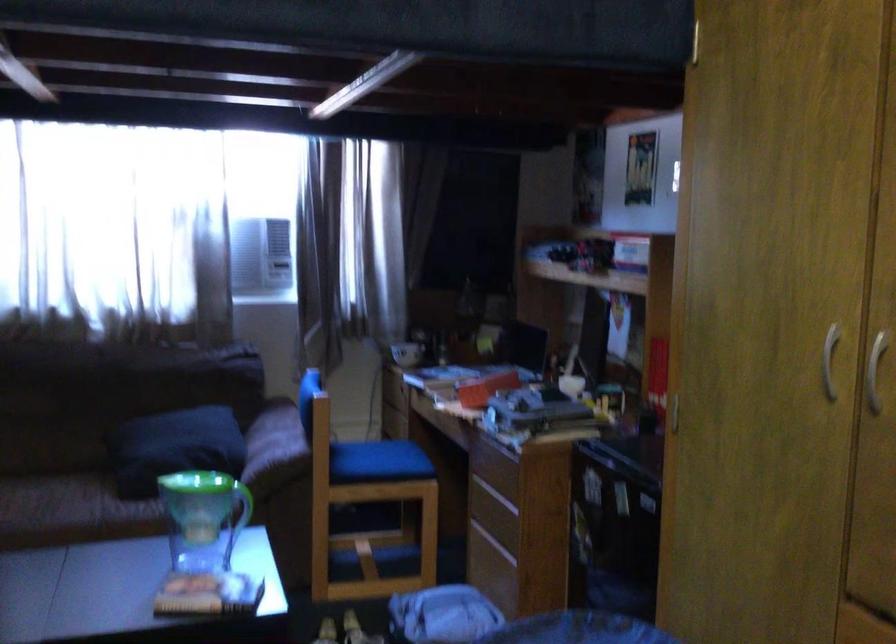
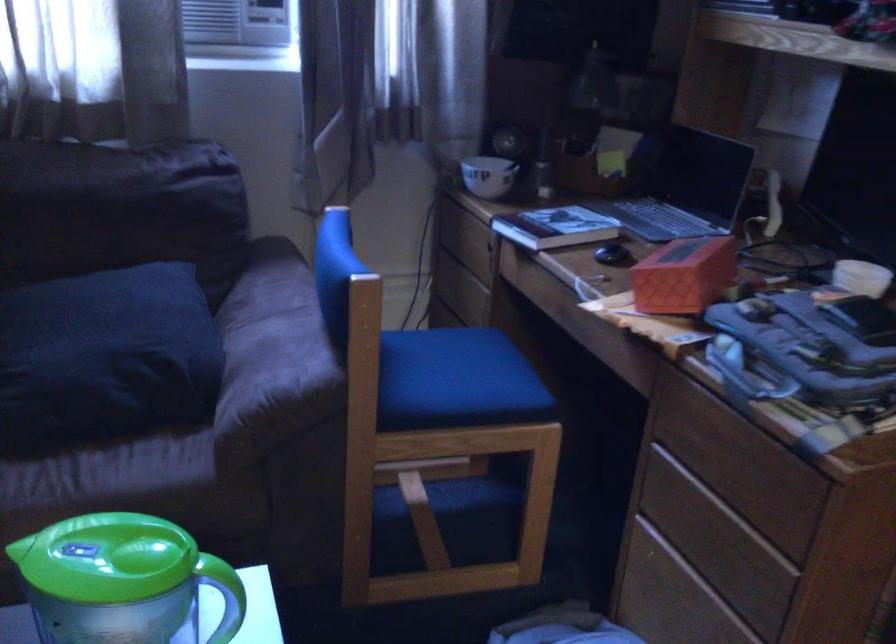
The point at (495,516) is marked in the first image. Where is the corresponding point in the second image?

(716, 541)